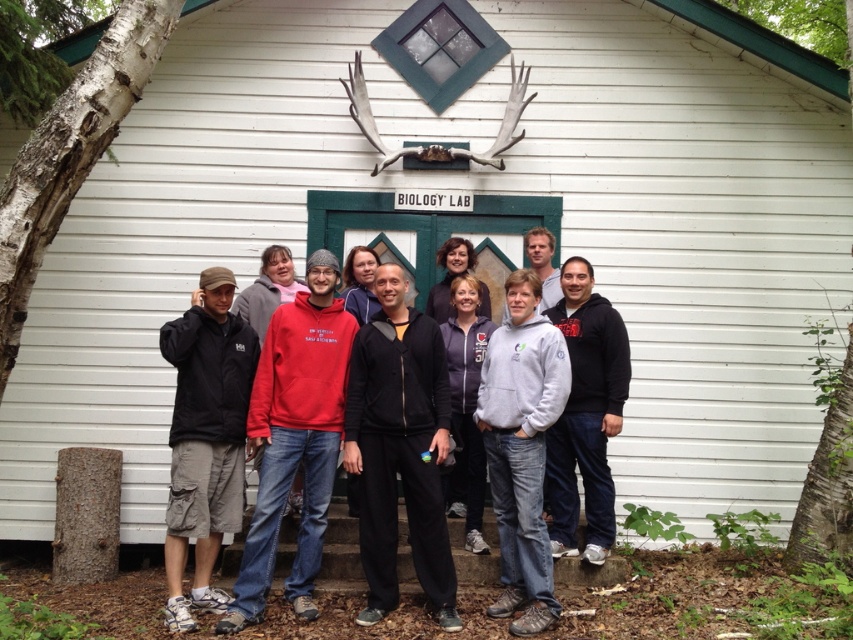
You are a photographer taking a group photo in front of the BIOLOGY LAB building. You notice the black matte jacket at center and the dark gray cotton cargo shorts at lower left. Which object is positioned lower in the image?

The black matte jacket at center is located below dark gray cotton cargo shorts at lower left, so the black matte jacket at center is positioned lower in the image.

You are a photographer taking a picture of the group in front of the BIOLOGY LAB building. You notice the black matte jacket at center and the dark gray cotton cargo shorts at lower left. Which object is closer to your camera lens?

The black matte jacket at center is closer to the camera lens because it is further to the viewer than the dark gray cotton cargo shorts at lower left.